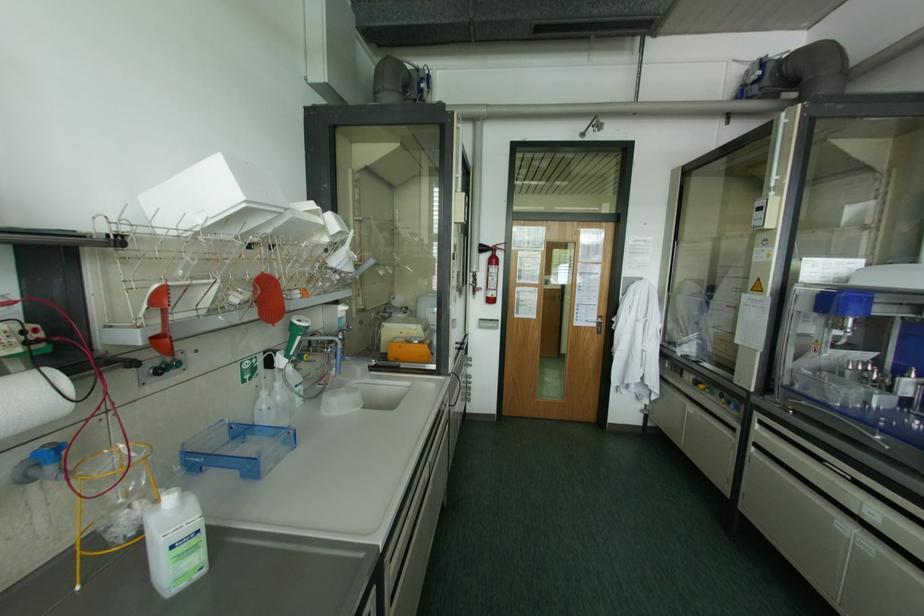
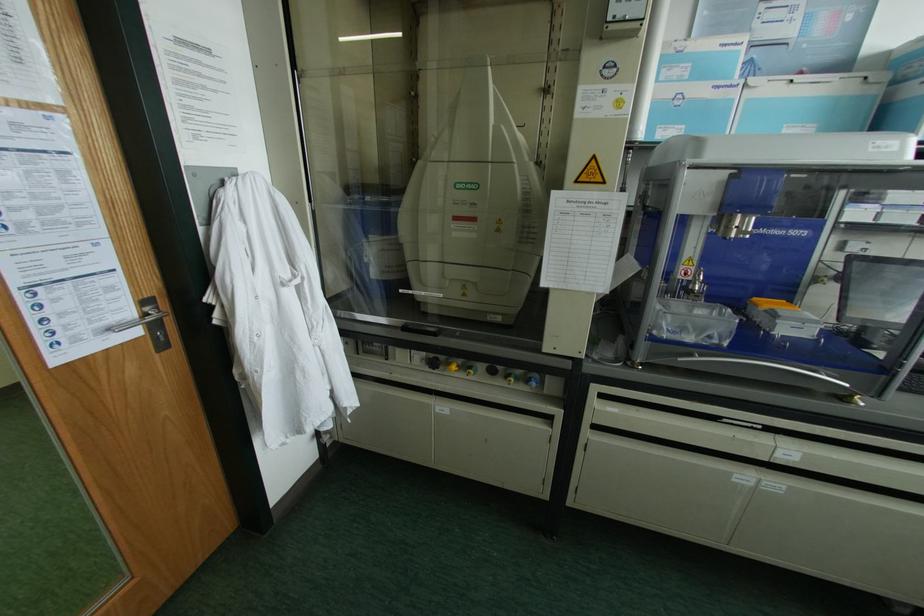
Where in the second image is the point corresponding to (x=599, y=315) from the first image?

(142, 302)